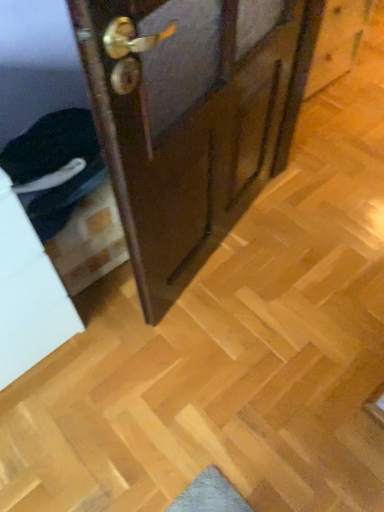
Find the location of a particular element. free space in front of wooden door at center is located at coordinates (208, 340).